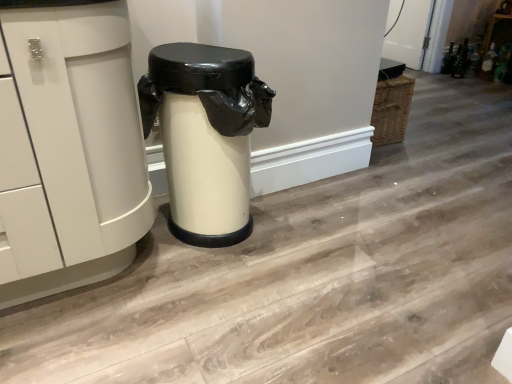
This screenshot has width=512, height=384. What do you see at coordinates (69, 150) in the screenshot?
I see `matte white cabinet at left` at bounding box center [69, 150].

What is the approximate width of matte white cabinet at left?

matte white cabinet at left is 25.68 inches in width.

Image resolution: width=512 pixels, height=384 pixels. I want to click on matte white cabinet at left, so click(69, 150).

This screenshot has height=384, width=512. I want to click on matte white cabinet at left, so (69, 150).